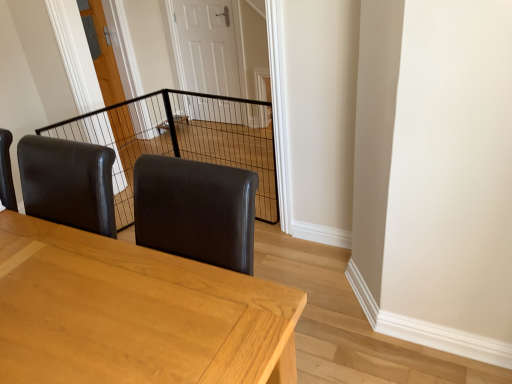
Describe the element at coordinates (205, 46) in the screenshot. I see `white glossy door at center, which appears as the second door when viewed from the left` at that location.

I want to click on black wire mesh at center, so 181,139.

Considering the relative sizes of wooden door at center, the second door from the right, and white glossy door at center, the first door positioned from the right, in the image provided, is wooden door at center, the second door from the right, taller than white glossy door at center, the first door positioned from the right,?

Indeed, wooden door at center, the second door from the right, has a greater height compared to white glossy door at center, the first door positioned from the right.

Considering the sizes of objects wooden door at center, the first door positioned from the left, and white glossy door at center, which appears as the second door when viewed from the left, in the image provided, who is smaller, wooden door at center, the first door positioned from the left, or white glossy door at center, which appears as the second door when viewed from the left,?

white glossy door at center, which appears as the second door when viewed from the left.

Is point (118, 148) farther from camera compared to point (225, 110)?

No, it is not.

Based on the photo, from the image's perspective, is wooden door at center, the second door from the right, below white glossy door at center, which appears as the second door when viewed from the left?

Correct, wooden door at center, the second door from the right, appears lower than white glossy door at center, which appears as the second door when viewed from the left, in the image.

Does point (10, 221) appear closer or farther from the camera than point (224, 162)?

Point (10, 221) is positioned closer to the camera compared to point (224, 162).

You are a GUI agent. You are given a task and a screenshot of the screen. Output one action in this format:
    pyautogui.click(x=<x>, y=<y>)
    Task: Click on the table in front of the black wire mesh at center
    
    Given the screenshot: What is the action you would take?
    pyautogui.click(x=134, y=313)

Based on their sizes in the image, would you say light brown wooden table at center is bigger or smaller than black wire mesh at center?

Considering their sizes, light brown wooden table at center takes up more space than black wire mesh at center.

From the image's perspective, which one is positioned higher, white glossy door at center, the first door positioned from the right, or light brown wooden table at center?

From the image's view, white glossy door at center, the first door positioned from the right, is above.

The height and width of the screenshot is (384, 512). In order to click on table located on the left of white glossy door at center, the first door positioned from the right in this screenshot , I will do `click(134, 313)`.

Consider the image. Does white glossy door at center, which appears as the second door when viewed from the left, turn towards light brown wooden table at center?

Yes, white glossy door at center, which appears as the second door when viewed from the left, is facing light brown wooden table at center.

Who is smaller, white glossy door at center, the first door positioned from the right, or light brown wooden table at center?

white glossy door at center, the first door positioned from the right, is smaller.

From a real-world perspective, does light brown wooden table at center sit lower than wooden door at center, the second door from the right?

Yes, from a real-world perspective, light brown wooden table at center is under wooden door at center, the second door from the right.

Which of these two, light brown wooden table at center or wooden door at center, the first door positioned from the left, is bigger?

With larger size is light brown wooden table at center.

Is wooden door at center, the second door from the right, surrounded by light brown wooden table at center?

No, wooden door at center, the second door from the right, is not surrounded by light brown wooden table at center.

Can you confirm if wooden door at center, the first door positioned from the left, is positioned to the right of black wire mesh at center?

No, wooden door at center, the first door positioned from the left, is not to the right of black wire mesh at center.

Between wooden door at center, the second door from the right, and black wire mesh at center, which one has smaller width?

Thinner between the two is black wire mesh at center.

Measure the distance between wooden door at center, the second door from the right, and black wire mesh at center.

They are 20.27 inches apart.

Is wooden door at center, the first door positioned from the left, turned away from black wire mesh at center?

No, black wire mesh at center is not at the back of wooden door at center, the first door positioned from the left.

Considering the sizes of objects black wire mesh at center and wooden door at center, the first door positioned from the left, in the image provided, who is thinner, black wire mesh at center or wooden door at center, the first door positioned from the left,?

black wire mesh at center is thinner.

From the image's perspective, does black wire mesh at center appear higher than wooden door at center, the second door from the right?

Actually, black wire mesh at center appears below wooden door at center, the second door from the right, in the image.

Is black wire mesh at center facing towards wooden door at center, the second door from the right?

No, black wire mesh at center does not turn towards wooden door at center, the second door from the right.

From a real-world perspective, is white glossy door at center, the first door positioned from the right, above or below wooden door at center, the first door positioned from the left?

white glossy door at center, the first door positioned from the right, is situated lower than wooden door at center, the first door positioned from the left, in the real world.

Locate an element on the screen. The image size is (512, 384). door below the wooden door at center, the second door from the right (from a real-world perspective) is located at coordinates (205, 46).

Who is smaller, white glossy door at center, which appears as the second door when viewed from the left, or wooden door at center, the first door positioned from the left?

white glossy door at center, which appears as the second door when viewed from the left.

Can you tell me how much white glossy door at center, which appears as the second door when viewed from the left, and wooden door at center, the second door from the right, differ in facing direction?

88.2 degrees.

In order to click on door in front of the white glossy door at center, which appears as the second door when viewed from the left in this screenshot , I will do `click(109, 82)`.

At what (x,y) coordinates should I click in order to perform the action: click on table below the black wire mesh at center (from a real-world perspective). Please return your answer as a coordinate pair (x, y). This screenshot has height=384, width=512. Looking at the image, I should click on (134, 313).

Estimate the real-world distances between objects in this image. Which object is closer to white glossy door at center, the first door positioned from the right, black wire mesh at center or wooden door at center, the first door positioned from the left?

Among the two, black wire mesh at center is located nearer to white glossy door at center, the first door positioned from the right.

Considering their positions, is white glossy door at center, which appears as the second door when viewed from the left, positioned further to wooden door at center, the second door from the right, than light brown wooden table at center?

light brown wooden table at center.

Considering their positions, is wooden door at center, the second door from the right, positioned closer to white glossy door at center, the first door positioned from the right, than black wire mesh at center?

black wire mesh at center is closer to white glossy door at center, the first door positioned from the right.

Which object lies nearer to the anchor point white glossy door at center, which appears as the second door when viewed from the left, black wire mesh at center or light brown wooden table at center?

Among the two, black wire mesh at center is located nearer to white glossy door at center, which appears as the second door when viewed from the left.

Looking at the image, which one is located closer to black wire mesh at center, wooden door at center, the first door positioned from the left, or white glossy door at center, which appears as the second door when viewed from the left?

white glossy door at center, which appears as the second door when viewed from the left, lies closer to black wire mesh at center than the other object.

Which object lies further to the anchor point wooden door at center, the second door from the right, light brown wooden table at center or black wire mesh at center?

light brown wooden table at center is positioned further to the anchor wooden door at center, the second door from the right.

From the picture: From the image, which object appears to be nearer to light brown wooden table at center, white glossy door at center, the first door positioned from the right, or black wire mesh at center?

The object closer to light brown wooden table at center is black wire mesh at center.

Looking at the image, which one is located further to wooden door at center, the second door from the right, black wire mesh at center or white glossy door at center, which appears as the second door when viewed from the left?

white glossy door at center, which appears as the second door when viewed from the left.

At what (x,y) coordinates should I click in order to perform the action: click on cage located between light brown wooden table at center and wooden door at center, the first door positioned from the left, in the depth direction. Please return your answer as a coordinate pair (x, y). Looking at the image, I should click on (181, 139).

Locate an element on the screen. The height and width of the screenshot is (384, 512). door located between light brown wooden table at center and white glossy door at center, which appears as the second door when viewed from the left, in the depth direction is located at coordinates (109, 82).

What are the coordinates of `door located between black wire mesh at center and white glossy door at center, the first door positioned from the right, in the depth direction` in the screenshot? It's located at (109, 82).

The height and width of the screenshot is (384, 512). I want to click on cage positioned between light brown wooden table at center and white glossy door at center, which appears as the second door when viewed from the left, from near to far, so click(x=181, y=139).